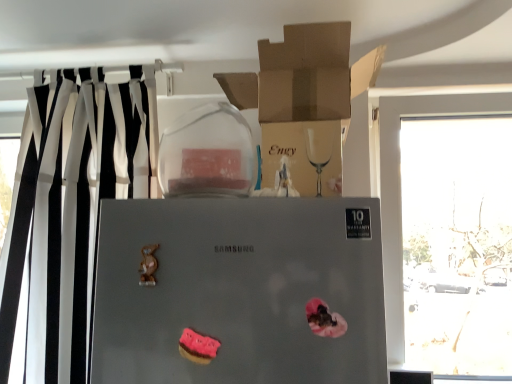
Question: Is satin silver refrigerator at center outside transparent glass window at right?

Choices:
 (A) no
 (B) yes

Answer: (B)

Question: Considering the relative sizes of satin silver refrigerator at center and transparent glass window at right in the image provided, is satin silver refrigerator at center smaller than transparent glass window at right?

Choices:
 (A) no
 (B) yes

Answer: (B)

Question: From a real-world perspective, is satin silver refrigerator at center on transparent glass window at right?

Choices:
 (A) no
 (B) yes

Answer: (A)

Question: Can you confirm if satin silver refrigerator at center is wider than transparent glass window at right?

Choices:
 (A) no
 (B) yes

Answer: (A)

Question: Is satin silver refrigerator at center looking in the opposite direction of transparent glass window at right?

Choices:
 (A) no
 (B) yes

Answer: (A)

Question: Is satin silver refrigerator at center facing towards transparent glass window at right?

Choices:
 (A) no
 (B) yes

Answer: (A)

Question: Is transparent glass window at right facing away from satin silver refrigerator at center?

Choices:
 (A) yes
 (B) no

Answer: (B)

Question: From a real-world perspective, does transparent glass window at right sit lower than satin silver refrigerator at center?

Choices:
 (A) yes
 (B) no

Answer: (B)

Question: From a real-world perspective, is transparent glass window at right positioned over satin silver refrigerator at center based on gravity?

Choices:
 (A) no
 (B) yes

Answer: (B)

Question: Is satin silver refrigerator at center completely or partially inside transparent glass window at right?

Choices:
 (A) yes
 (B) no

Answer: (B)

Question: From the image's perspective, does transparent glass window at right appear lower than satin silver refrigerator at center?

Choices:
 (A) no
 (B) yes

Answer: (A)

Question: Considering the relative sizes of transparent glass window at right and satin silver refrigerator at center in the image provided, is transparent glass window at right wider than satin silver refrigerator at center?

Choices:
 (A) yes
 (B) no

Answer: (A)

Question: Is satin silver refrigerator at center outside pink frosted cookie at lower center?

Choices:
 (A) no
 (B) yes

Answer: (B)